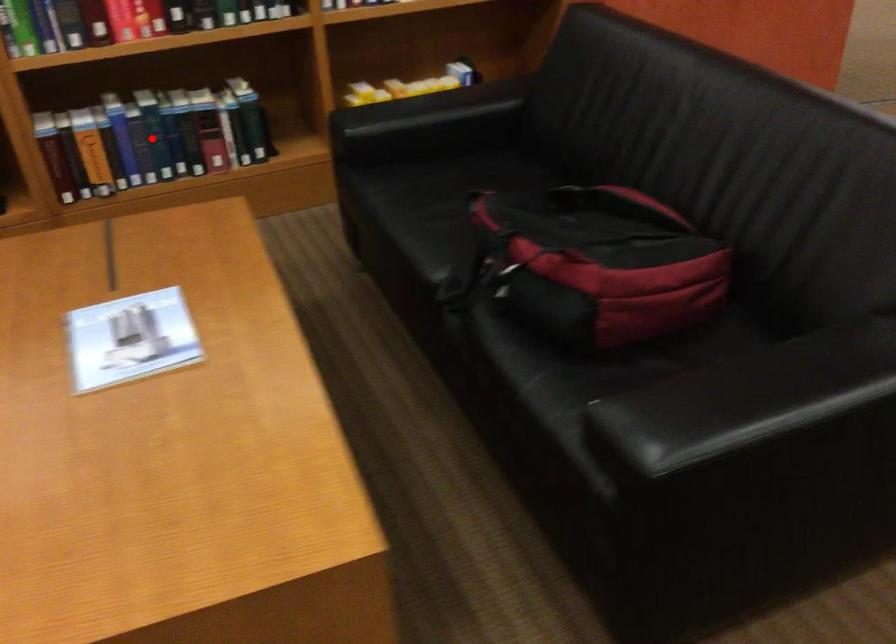
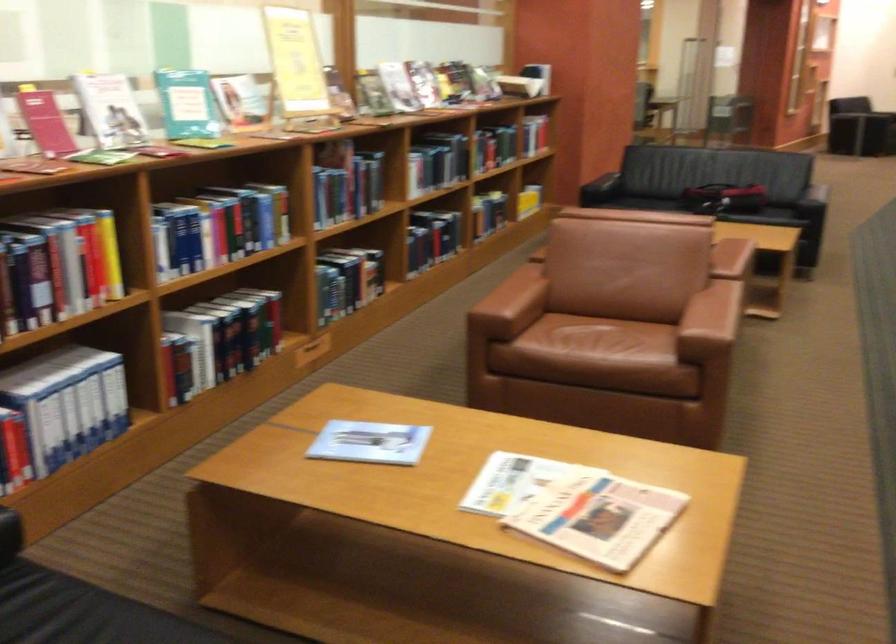
Question: I am providing you with two images of the same scene from different viewpoints. Image1 has a red point marked. In image2, the corresponding 3D location appears at what relative position? Reply with the corresponding letter.

Choices:
 (A) Closer
 (B) Farther

Answer: (B)